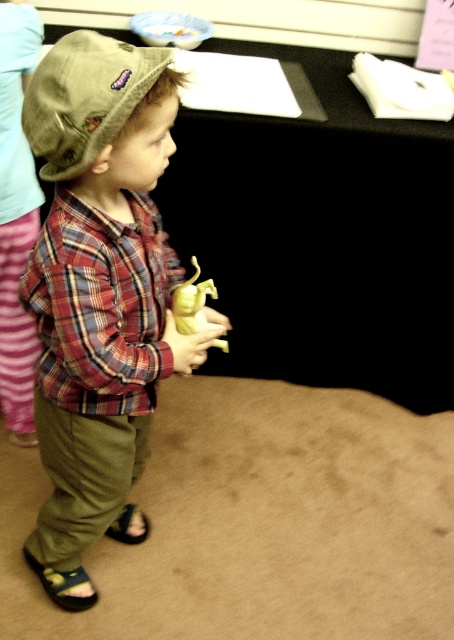
Does plaid cotton shirt at center lie in front of plaid fabric shirt at center?

Yes, plaid cotton shirt at center is closer to the viewer.

Find the location of `plaid cotton shirt at center`. plaid cotton shirt at center is located at coordinates (97, 291).

Does point (85, 524) lie behind point (117, 301)?

Yes, point (85, 524) is farther from viewer.

Find the location of `plaid cotton shirt at center`. plaid cotton shirt at center is located at coordinates (97, 291).

Does green fabric pants at lower left appear under plaid fabric shirt at center?

Yes.

Who is taller, green fabric pants at lower left or plaid fabric shirt at center?

green fabric pants at lower left

Where is `green fabric pants at lower left`? This screenshot has height=640, width=454. green fabric pants at lower left is located at coordinates (260, 522).

I want to click on green fabric pants at lower left, so click(x=260, y=522).

Between plaid fabric shirt at center and green fabric hat at upper left, which one is positioned lower?

plaid fabric shirt at center is lower down.

In the scene shown: Does plaid fabric shirt at center have a greater height compared to green fabric hat at upper left?

Yes, plaid fabric shirt at center is taller than green fabric hat at upper left.

Image resolution: width=454 pixels, height=640 pixels. What do you see at coordinates (100, 307) in the screenshot? I see `plaid fabric shirt at center` at bounding box center [100, 307].

Find the location of a particular element. plaid fabric shirt at center is located at coordinates (100, 307).